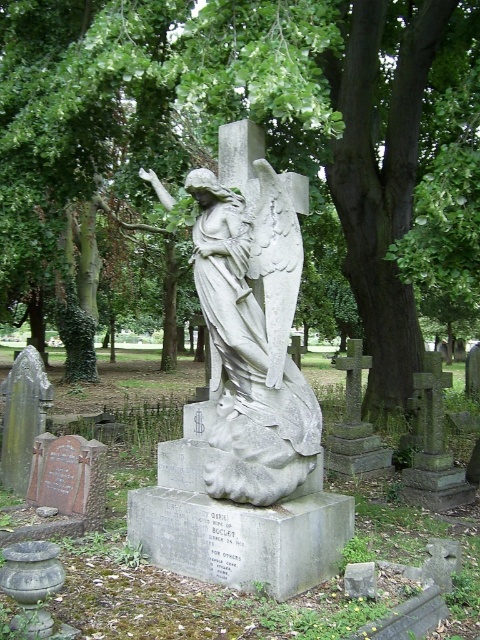
You are standing in the cemetery and want to take a photo of the gray stone angel at center without the green leafy tree at center blocking it. Which direction should you move to ensure the tree is out of the frame?

Move to the right side of the gray stone angel at center so that the green leafy tree at center, which is on the left of the angel, is no longer in the frame.

You are a visitor at the cemetery and want to place a bouquet of flowers between the green leafy tree at center and the gray stone angel at center. Given that the bouquet requires 1.5 meters of space to be placed safely, can you determine if there is enough space between them?

The green leafy tree at center is 3.80 meters away from the gray stone angel at center, so yes, there is enough space to place the bouquet between them since the distance is greater than the required 1.5 meters.

You are standing in the cemetery and want to take a photo of the gray stone angel at center. However, there is a green leafy tree at center blocking your view. Can you move to the side to avoid the tree while still keeping the angel in frame?

The green leafy tree at center is further to the viewer than gray stone angel at center, so moving to the side might allow you to position yourself where the tree is no longer blocking the angel while keeping it in the frame.